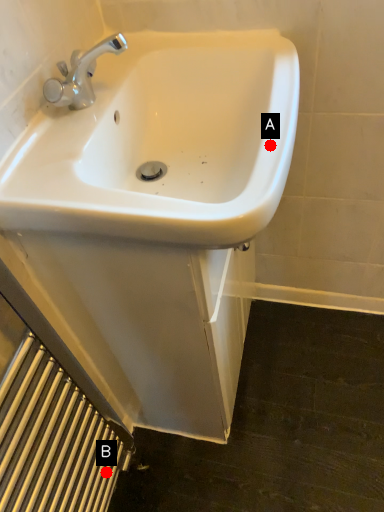
Question: Two points are circled on the image, labeled by A and B beside each circle. Which point is closer to the camera?

Choices:
 (A) A is closer
 (B) B is closer

Answer: (A)